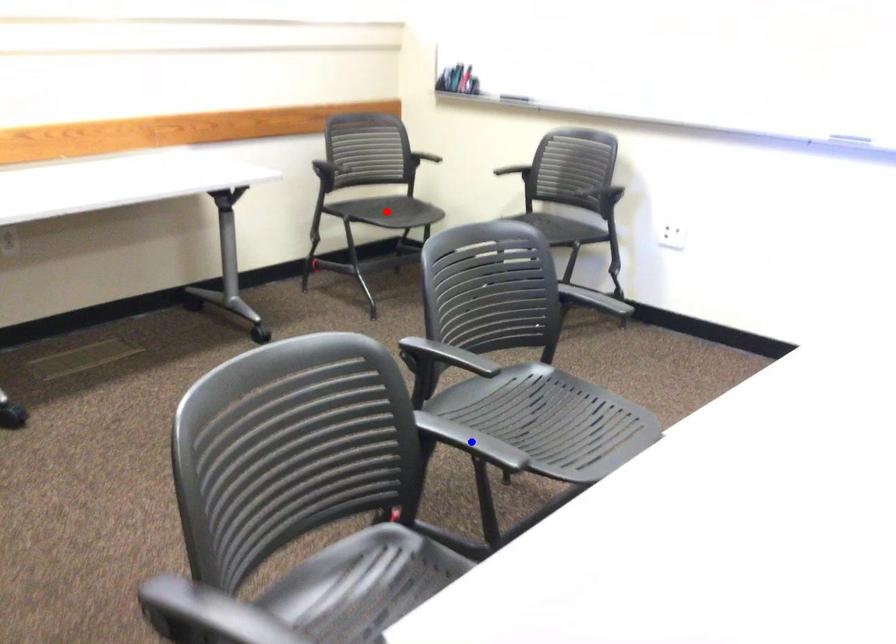
Question: Which of the two points in the image is closer to the camera?

Choices:
 (A) Blue point is closer.
 (B) Red point is closer.

Answer: (A)